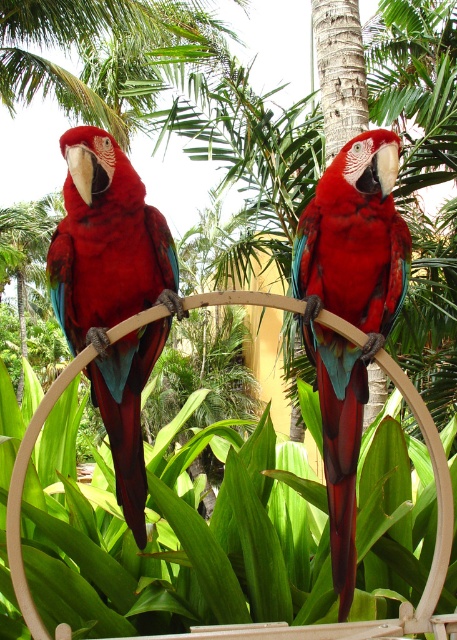
You are standing in front of the bird feeder and want to place a small treat between the two points, point 1 at point (118, 467) and point 2 at point (350, 173). Which point is closer to you so you can place the treat there?

Point (118, 467) is closer to you than point (350, 173), so you can place the treat there.

You are a wildlife photographer aiming to capture a photo of the matte red parrot at left. Based on its 2D coordinates in the image, which direction should you adjust your camera to focus on it?

The matte red parrot at left is located at coordinates point (112, 292), so you should adjust your camera slightly to the left and downward to focus on it.

You are a birdwatcher observing two parrots in a tropical setting. You see the matte red parrot at left and the shiny red parrot at center. Which parrot is positioned to the right of the other?

The shiny red parrot at center is positioned to the right of the matte red parrot at left.